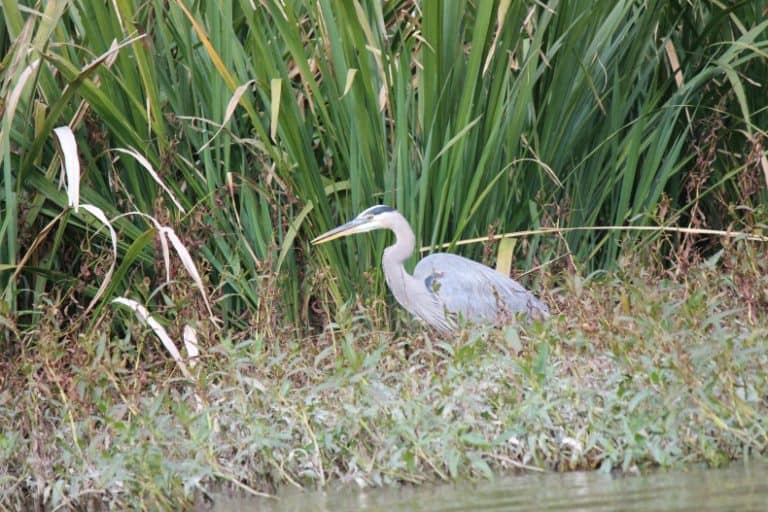
You are a GUI agent. You are given a task and a screenshot of the screen. Output one action in this format:
    pyautogui.click(x=<x>, y=<y>)
    Task: Click on the tall leafy plant
    
    Given the screenshot: What is the action you would take?
    (x=435, y=146), (x=551, y=104), (x=189, y=78), (x=339, y=67)